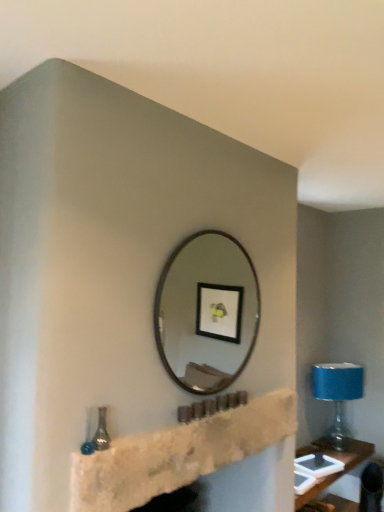
Question: Does metallic silver mirror at center have a larger size compared to blue fabric lampshade at right?

Choices:
 (A) yes
 (B) no

Answer: (B)

Question: From a real-world perspective, is metallic silver mirror at center located higher than blue fabric lampshade at right?

Choices:
 (A) no
 (B) yes

Answer: (B)

Question: Is metallic silver mirror at center at the right side of blue fabric lampshade at right?

Choices:
 (A) no
 (B) yes

Answer: (A)

Question: Considering the relative sizes of metallic silver mirror at center and blue fabric lampshade at right in the image provided, is metallic silver mirror at center taller than blue fabric lampshade at right?

Choices:
 (A) no
 (B) yes

Answer: (B)

Question: From the image's perspective, would you say metallic silver mirror at center is positioned over blue fabric lampshade at right?

Choices:
 (A) yes
 (B) no

Answer: (A)

Question: Would you say stone fireplace at center is inside or outside blue fabric lampshade at right?

Choices:
 (A) inside
 (B) outside

Answer: (B)

Question: From the image's perspective, is stone fireplace at center above or below blue fabric lampshade at right?

Choices:
 (A) above
 (B) below

Answer: (A)

Question: Would you say stone fireplace at center is to the left or to the right of blue fabric lampshade at right in the picture?

Choices:
 (A) right
 (B) left

Answer: (B)

Question: From a real-world perspective, is stone fireplace at center positioned above or below blue fabric lampshade at right?

Choices:
 (A) below
 (B) above

Answer: (B)

Question: Relative to metallic silver mirror at center, is blue fabric lampshade at right in front or behind?

Choices:
 (A) front
 (B) behind

Answer: (B)

Question: Based on their sizes in the image, would you say blue fabric lampshade at right is bigger or smaller than metallic silver mirror at center?

Choices:
 (A) small
 (B) big

Answer: (B)

Question: From the image's perspective, relative to metallic silver mirror at center, is blue fabric lampshade at right above or below?

Choices:
 (A) above
 (B) below

Answer: (B)

Question: From a real-world perspective, is blue fabric lampshade at right above or below metallic silver mirror at center?

Choices:
 (A) below
 (B) above

Answer: (A)

Question: Choose the correct answer: Is stone fireplace at center inside metallic silver mirror at center or outside it?

Choices:
 (A) outside
 (B) inside

Answer: (A)

Question: Is point (137, 476) positioned closer to the camera than point (205, 381)?

Choices:
 (A) closer
 (B) farther

Answer: (A)